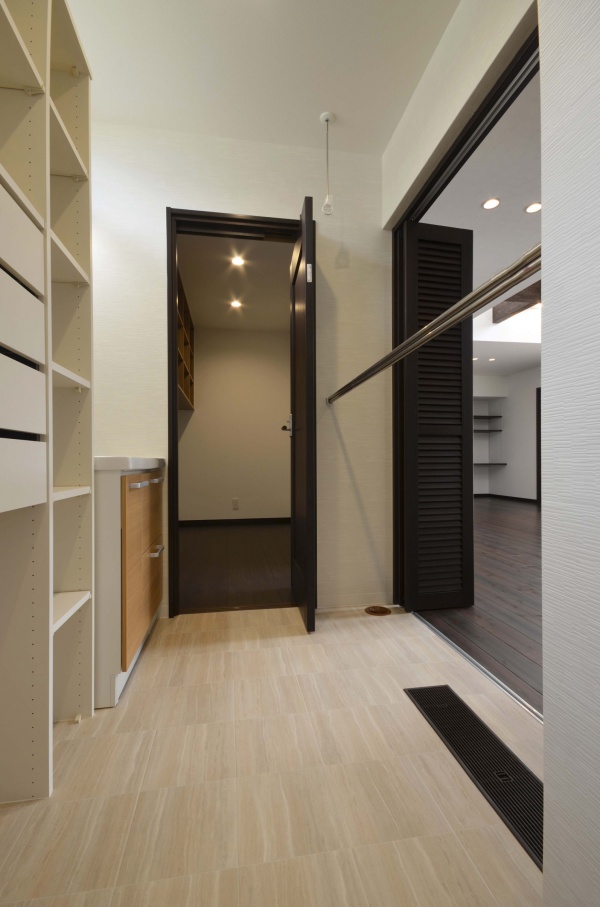
The width and height of the screenshot is (600, 907). In order to click on shelves in this screenshot , I will do `click(71, 605)`, `click(64, 493)`, `click(23, 45)`, `click(17, 192)`, `click(70, 140)`, `click(72, 258)`, `click(72, 376)`, `click(497, 415)`, `click(497, 428)`, `click(499, 462)`.